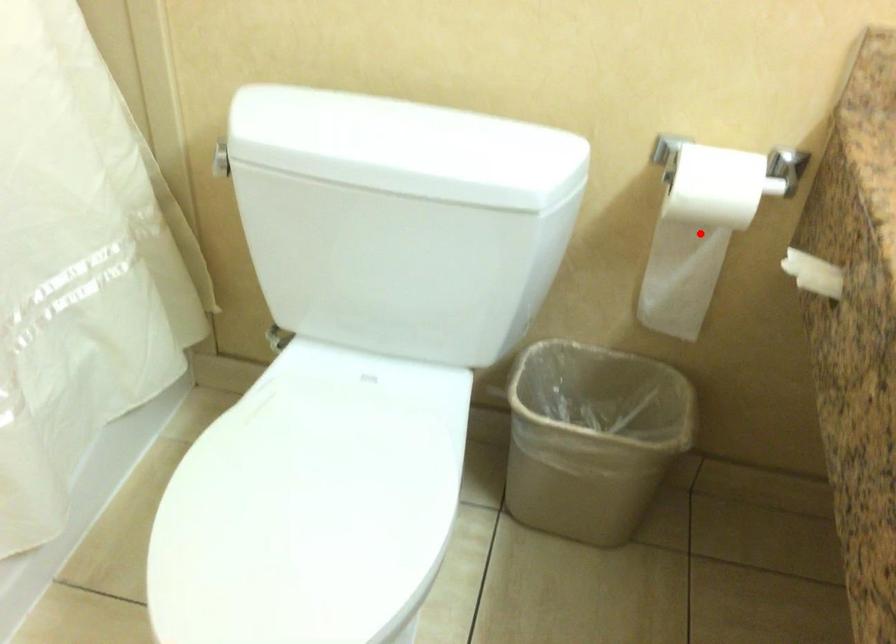
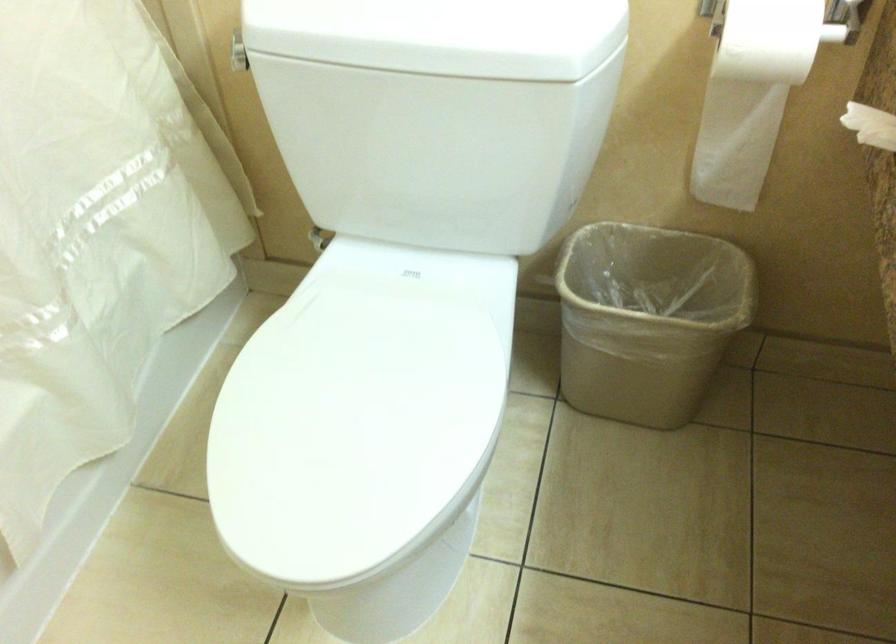
Find the pixel in the second image that matches the highlighted location in the first image.

(752, 93)